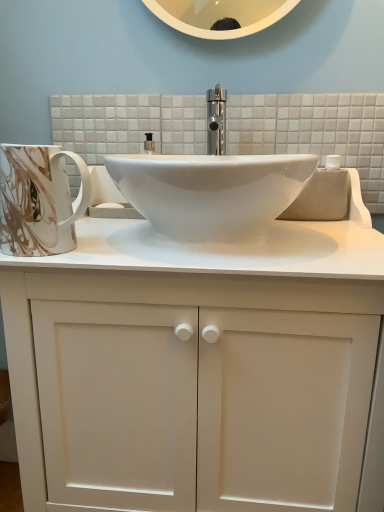
Question: From a real-world perspective, does marble-patterned ceramic mug at left stand above white matte cabinet at center?

Choices:
 (A) no
 (B) yes

Answer: (B)

Question: Is marble-patterned ceramic mug at left in contact with white matte cabinet at center?

Choices:
 (A) no
 (B) yes

Answer: (A)

Question: Are marble-patterned ceramic mug at left and white matte cabinet at center far apart?

Choices:
 (A) yes
 (B) no

Answer: (B)

Question: Is marble-patterned ceramic mug at left smaller than white matte cabinet at center?

Choices:
 (A) yes
 (B) no

Answer: (A)

Question: From the image's perspective, is marble-patterned ceramic mug at left located above white matte cabinet at center?

Choices:
 (A) yes
 (B) no

Answer: (A)

Question: Can you confirm if marble-patterned ceramic mug at left is thinner than white matte cabinet at center?

Choices:
 (A) no
 (B) yes

Answer: (B)

Question: Does white matte cabinet at center contain marble-patterned ceramic mug at left?

Choices:
 (A) yes
 (B) no

Answer: (A)

Question: Does white matte cabinet at center have a lesser width compared to marble-patterned ceramic mug at left?

Choices:
 (A) no
 (B) yes

Answer: (A)

Question: Are white matte cabinet at center and marble-patterned ceramic mug at left located far from each other?

Choices:
 (A) no
 (B) yes

Answer: (A)

Question: Does white matte cabinet at center appear on the right side of marble-patterned ceramic mug at left?

Choices:
 (A) yes
 (B) no

Answer: (A)

Question: Does white matte cabinet at center touch marble-patterned ceramic mug at left?

Choices:
 (A) yes
 (B) no

Answer: (B)

Question: From the image's perspective, is white matte cabinet at center on top of marble-patterned ceramic mug at left?

Choices:
 (A) no
 (B) yes

Answer: (A)

Question: In terms of width, does white matte cabinet at center look wider or thinner when compared to marble-patterned ceramic mug at left?

Choices:
 (A) thin
 (B) wide

Answer: (B)